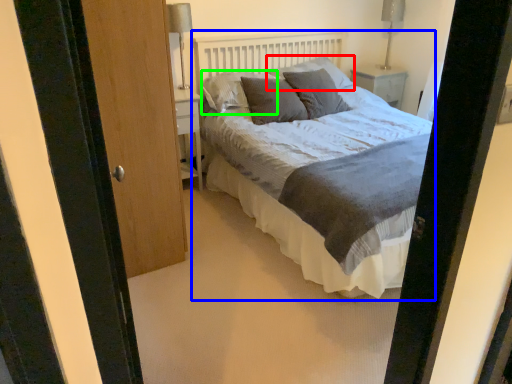
Question: Based on their relative distances, which object is farther from pillow (highlighted by a red box)? Choose from bed (highlighted by a blue box) and pillow (highlighted by a green box).

Choices:
 (A) bed
 (B) pillow

Answer: (A)